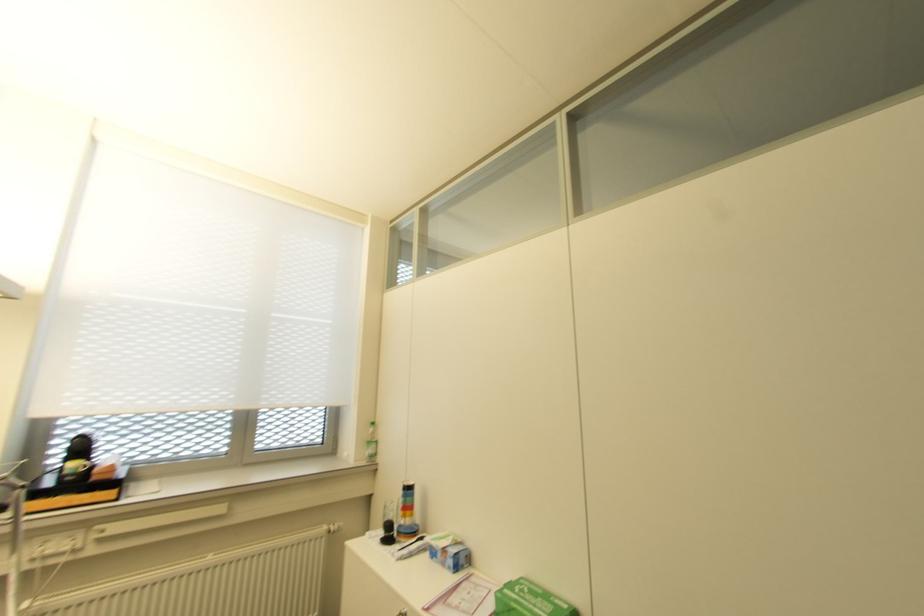
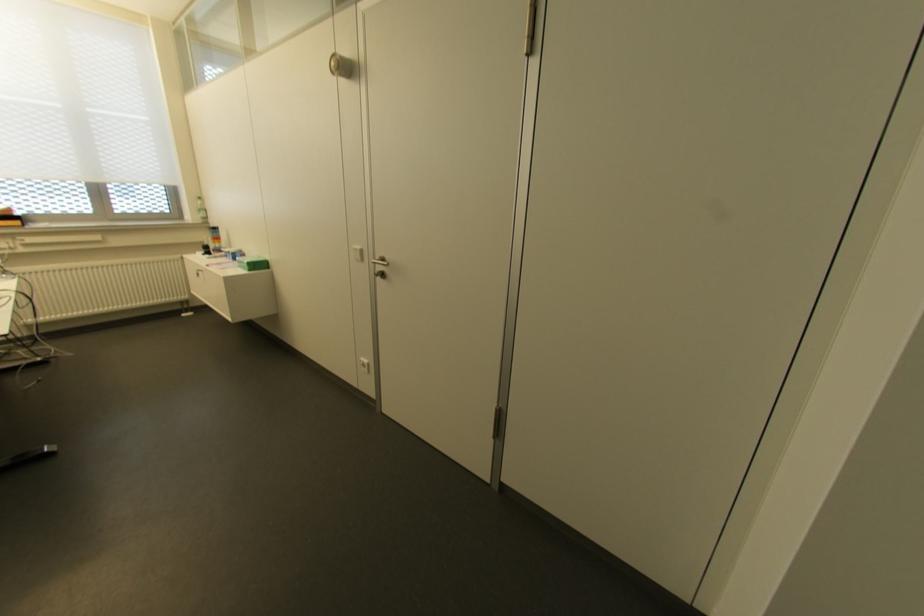
The point at (372, 455) is marked in the first image. Where is the corresponding point in the second image?

(204, 217)